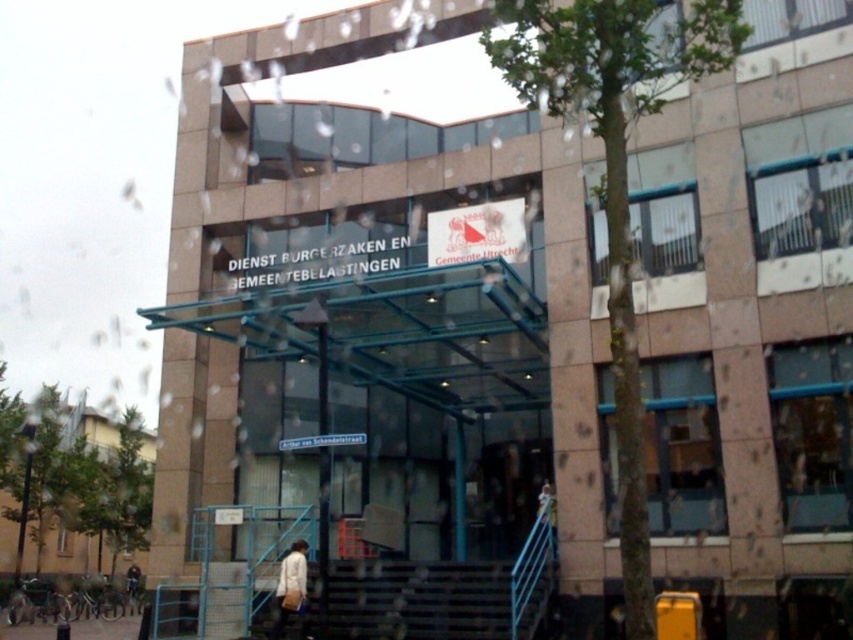
Question: Which point appears closest to the camera in this image?

Choices:
 (A) (548, 484)
 (B) (297, 580)
 (C) (465, 563)

Answer: (B)

Question: Can you confirm if metallic gray stairs at lower center is positioned below light brown leather jacket at lower center?

Choices:
 (A) yes
 (B) no

Answer: (A)

Question: Among these points, which one is nearest to the camera?

Choices:
 (A) (286, 573)
 (B) (335, 624)

Answer: (A)

Question: In this image, where is white fabric bag at lower center located relative to light brown leather jacket at lower center?

Choices:
 (A) above
 (B) below

Answer: (B)

Question: Is metallic gray stairs at lower center below white fabric bag at lower center?

Choices:
 (A) no
 (B) yes

Answer: (B)

Question: Among these points, which one is nearest to the camera?

Choices:
 (A) (317, 621)
 (B) (277, 636)
 (C) (549, 490)

Answer: (B)